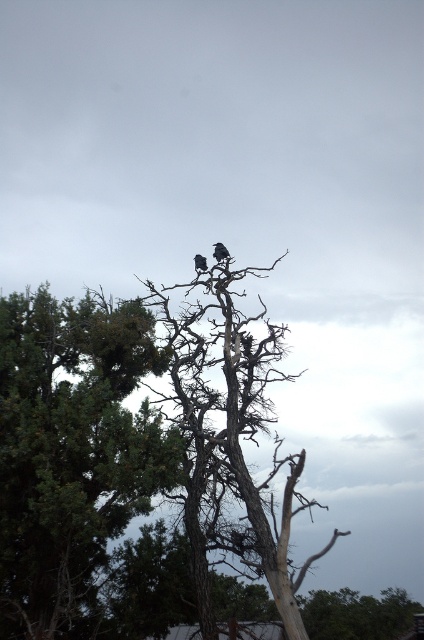
Question: Estimate the real-world distances between objects in this image. Which object is farther from the green leafy tree at upper center?

Choices:
 (A) shiny black bird at top
 (B) dark gray feathers at center

Answer: (B)

Question: Which point is closer to the camera?

Choices:
 (A) shiny black bird at top
 (B) dark gray feathers at center
 (C) dead wood tree at center

Answer: (C)

Question: Is dark gray feathers at center thinner than shiny black bird at top?

Choices:
 (A) yes
 (B) no

Answer: (B)

Question: Considering the real-world distances, which object is farthest from the dead wood tree at center?

Choices:
 (A) shiny black bird at top
 (B) green leafy tree at upper center
 (C) dark gray feathers at center

Answer: (C)

Question: Can you confirm if dead wood tree at center is thinner than shiny black bird at top?

Choices:
 (A) no
 (B) yes

Answer: (A)

Question: Does green leafy tree at upper center appear under dark gray feathers at center?

Choices:
 (A) no
 (B) yes

Answer: (B)